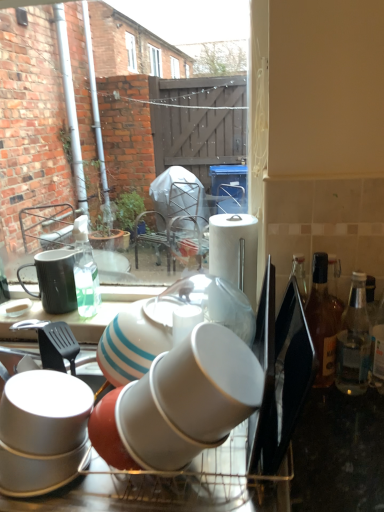
The image size is (384, 512). What are the coordinates of `white glossy cup at center, marked as the 1th tableware in a right-to-left arrangement` in the screenshot? It's located at (169, 325).

What do you see at coordinates (223, 444) in the screenshot? This screenshot has width=384, height=512. I see `white glossy cups at center` at bounding box center [223, 444].

In order to click on clear glass bottle at right, which is the second bottle in left-to-right order in this screenshot , I will do `click(353, 341)`.

Where is `translucent glass bottle at right, placed as the first bottle when sorted from left to right`? The height and width of the screenshot is (512, 384). translucent glass bottle at right, placed as the first bottle when sorted from left to right is located at coordinates (323, 321).

How much space does translucent glass bottle at right, positioned as the 2th bottle in right-to-left order, occupy horizontally?

It is 3.85 inches.

What do you see at coordinates (235, 251) in the screenshot?
I see `white matte paper towel at upper right` at bounding box center [235, 251].

Locate an element on the screen. white glossy cup at center, marked as the 1th tableware in a right-to-left arrangement is located at coordinates (169, 325).

Is matte black mug at left, the second tableware when ordered from front to back, bigger or smaller than white glossy cup at lower left?

matte black mug at left, the second tableware when ordered from front to back, is smaller than white glossy cup at lower left.

Between point (72, 290) and point (38, 442), which one is positioned behind?

The point (72, 290) is farther.

Does matte black mug at left, which is counted as the second tableware, starting from the right, have a lesser height compared to white glossy cup at lower left?

Incorrect, the height of matte black mug at left, which is counted as the second tableware, starting from the right, does not fall short of that of white glossy cup at lower left.

Does matte black mug at left, which is the first tableware in left-to-right order, turn towards white glossy cup at lower left?

No.

From a real-world perspective, is clear glass bottle at right, which is the second bottle in left-to-right order, physically located above or below white matte paper towel at upper right?

Clearly, from a real-world perspective, clear glass bottle at right, which is the second bottle in left-to-right order, is below white matte paper towel at upper right.

Which is behind, clear glass bottle at right, which is the second bottle in left-to-right order, or white matte paper towel at upper right?

Positioned behind is white matte paper towel at upper right.

Could you measure the distance between clear glass bottle at right, which is the second bottle in left-to-right order, and white matte paper towel at upper right?

clear glass bottle at right, which is the second bottle in left-to-right order, and white matte paper towel at upper right are 10.79 inches apart from each other.

What's the angular difference between clear glass bottle at right, which is the second bottle in left-to-right order, and white matte paper towel at upper right's facing directions?

1.44 degrees separate the facing orientations of clear glass bottle at right, which is the second bottle in left-to-right order, and white matte paper towel at upper right.

Considering the relative sizes of white glossy cups at center and matte black mug at left, which is the first tableware in left-to-right order, in the image provided, is white glossy cups at center smaller than matte black mug at left, which is the first tableware in left-to-right order,?

Incorrect, white glossy cups at center is not smaller in size than matte black mug at left, which is the first tableware in left-to-right order.

Between white glossy cups at center and matte black mug at left, which is counted as the second tableware, starting from the right, which one has larger width?

Wider between the two is white glossy cups at center.

Is white glossy cups at center looking in the opposite direction of matte black mug at left, the second tableware when ordered from front to back?

No, white glossy cups at center is not facing away from matte black mug at left, the second tableware when ordered from front to back.

Would you say white glossy cups at center is inside or outside matte black mug at left, which is the first tableware in left-to-right order?

white glossy cups at center is spatially situated outside matte black mug at left, which is the first tableware in left-to-right order.

How different are the orientations of clear glass bottle at right, which is the second bottle in left-to-right order, and translucent glass bottle at right, placed as the first bottle when sorted from left to right, in degrees?

0.000137 degrees.

Is the depth of clear glass bottle at right, the first bottle in the right-to-left sequence, greater than that of translucent glass bottle at right, positioned as the 2th bottle in right-to-left order?

No, the depth of clear glass bottle at right, the first bottle in the right-to-left sequence, is less than that of translucent glass bottle at right, positioned as the 2th bottle in right-to-left order.

Is the surface of clear glass bottle at right, the first bottle in the right-to-left sequence, in direct contact with translucent glass bottle at right, placed as the first bottle when sorted from left to right?

Indeed, clear glass bottle at right, the first bottle in the right-to-left sequence, and translucent glass bottle at right, placed as the first bottle when sorted from left to right, are beside each other and touching.

From a real-world perspective, which object stands above the other?

translucent glass bottle at right, placed as the first bottle when sorted from left to right, is physically above.

Considering the sizes of objects white matte paper towel at upper right and white glossy cup at lower left in the image provided, who is wider, white matte paper towel at upper right or white glossy cup at lower left?

Wider between the two is white glossy cup at lower left.

Is white matte paper towel at upper right bigger than white glossy cup at lower left?

Incorrect, white matte paper towel at upper right is not larger than white glossy cup at lower left.

Is white matte paper towel at upper right far from white glossy cup at lower left?

No, white matte paper towel at upper right is in close proximity to white glossy cup at lower left.

Is matte black mug at left, which is counted as the second tableware, starting from the right, closer to the viewer compared to white glossy cup at center, the second tableware in the back-to-front sequence?

That is False.

Is white glossy cup at center, marked as the 1th tableware in a right-to-left arrangement, at the back of matte black mug at left, the 1th tableware positioned from the back?

No, matte black mug at left, the 1th tableware positioned from the back,'s orientation is not away from white glossy cup at center, marked as the 1th tableware in a right-to-left arrangement.

Considering the sizes of objects matte black mug at left, which is the first tableware in left-to-right order, and white glossy cup at center, marked as the 1th tableware in a right-to-left arrangement, in the image provided, who is taller, matte black mug at left, which is the first tableware in left-to-right order, or white glossy cup at center, marked as the 1th tableware in a right-to-left arrangement,?

white glossy cup at center, marked as the 1th tableware in a right-to-left arrangement, is taller.

Between white glossy cup at center, placed as the 2th tableware when sorted from left to right, and clear glass bottle at right, which is the second bottle in left-to-right order, which one has larger width?

white glossy cup at center, placed as the 2th tableware when sorted from left to right, is wider.

Are white glossy cup at center, marked as the 1th tableware in a right-to-left arrangement, and clear glass bottle at right, the first bottle in the right-to-left sequence, making contact?

white glossy cup at center, marked as the 1th tableware in a right-to-left arrangement, is not next to clear glass bottle at right, the first bottle in the right-to-left sequence, and they're not touching.

Is white glossy cup at center, the second tableware in the back-to-front sequence, turned away from clear glass bottle at right, the first bottle in the right-to-left sequence?

No, clear glass bottle at right, the first bottle in the right-to-left sequence, is not at the back of white glossy cup at center, the second tableware in the back-to-front sequence.

Is point (250, 309) in front of point (351, 311)?

No, (250, 309) is behind (351, 311).

At what (x,y) coordinates should I click in order to perform the action: click on coffee cup located below the matte black mug at left, which is the first tableware in left-to-right order (from the image's perspective). Please return your answer as a coordinate pair (x, y). This screenshot has width=384, height=512. Looking at the image, I should click on pyautogui.click(x=45, y=412).

Find the location of a particular element. This screenshot has width=384, height=512. bottle that is the 2nd object located in front of the white matte paper towel at upper right is located at coordinates (353, 341).

Consider the image. Which object lies nearer to the anchor point translucent glass bottle at right, positioned as the 2th bottle in right-to-left order, white matte paper towel at upper right or clear glass bottle at right, the first bottle in the right-to-left sequence?

clear glass bottle at right, the first bottle in the right-to-left sequence, is closer to translucent glass bottle at right, positioned as the 2th bottle in right-to-left order.

From the image, which object appears to be farther from white glossy cup at center, marked as the 1th tableware in a right-to-left arrangement, clear glass bottle at right, the first bottle in the right-to-left sequence, or white glossy cup at lower left?

clear glass bottle at right, the first bottle in the right-to-left sequence, is further to white glossy cup at center, marked as the 1th tableware in a right-to-left arrangement.

From the image, which object appears to be farther from translucent glass bottle at right, positioned as the 2th bottle in right-to-left order, white glossy cup at lower left or white glossy cups at center?

white glossy cup at lower left.

Estimate the real-world distances between objects in this image. Which object is further from white matte paper towel at upper right, matte black mug at left, which is the first tableware in left-to-right order, or translucent glass bottle at right, positioned as the 2th bottle in right-to-left order?

matte black mug at left, which is the first tableware in left-to-right order.

When comparing their distances from white matte paper towel at upper right, does white glossy cups at center or translucent glass bottle at right, positioned as the 2th bottle in right-to-left order, seem further?

white glossy cups at center.

Looking at this image, which object lies nearer to the anchor point white glossy cup at center, the second tableware in the back-to-front sequence, matte black mug at left, which is counted as the second tableware, starting from the right, or white glossy cups at center?

Among the two, white glossy cups at center is located nearer to white glossy cup at center, the second tableware in the back-to-front sequence.

From the image, which object appears to be farther from white glossy cup at center, the second tableware in the back-to-front sequence, white glossy cup at lower left or white glossy cups at center?

white glossy cup at lower left lies further to white glossy cup at center, the second tableware in the back-to-front sequence, than the other object.

Looking at this image, from the image, which object appears to be nearer to white glossy cup at center, the second tableware in the back-to-front sequence, matte black mug at left, the 1th tableware positioned from the back, or white glossy cup at lower left?

white glossy cup at lower left is positioned closer to the anchor white glossy cup at center, the second tableware in the back-to-front sequence.

At what (x,y) coordinates should I click in order to perform the action: click on paper towel located between white glossy cup at center, the 1th tableware viewed from the front, and clear glass bottle at right, which is the second bottle in left-to-right order, in the left-right direction. Please return your answer as a coordinate pair (x, y). The width and height of the screenshot is (384, 512). Looking at the image, I should click on (235, 251).

Identify the location of paper towel situated between white glossy cup at center, placed as the 2th tableware when sorted from left to right, and translucent glass bottle at right, positioned as the 2th bottle in right-to-left order, from left to right. (235, 251).

Image resolution: width=384 pixels, height=512 pixels. What are the coordinates of `tableware situated between matte black mug at left, the 1th tableware positioned from the back, and white matte paper towel at upper right from left to right` in the screenshot? It's located at (169, 325).

I want to click on coffee cup between white glossy cups at center and matte black mug at left, which is the first tableware in left-to-right order, along the z-axis, so click(x=45, y=412).